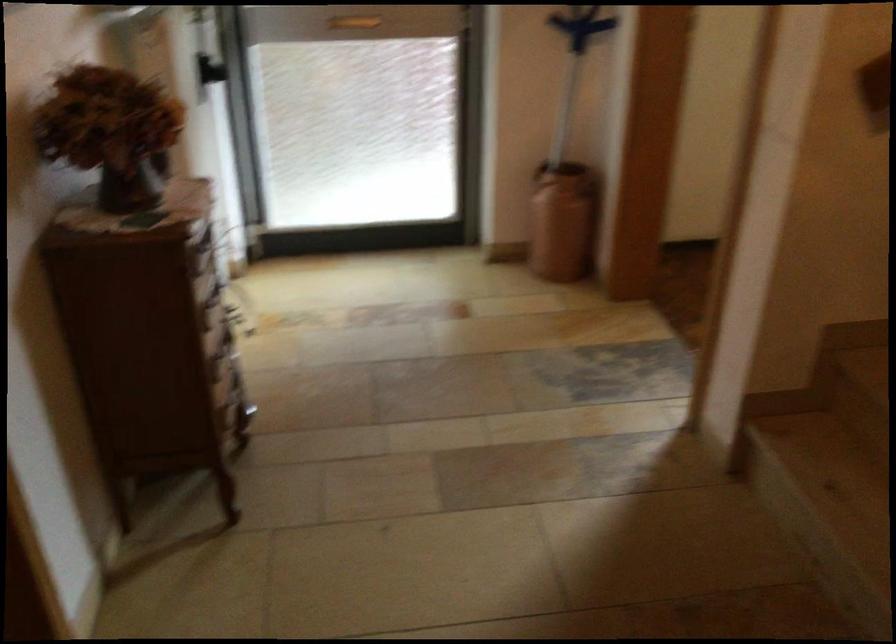
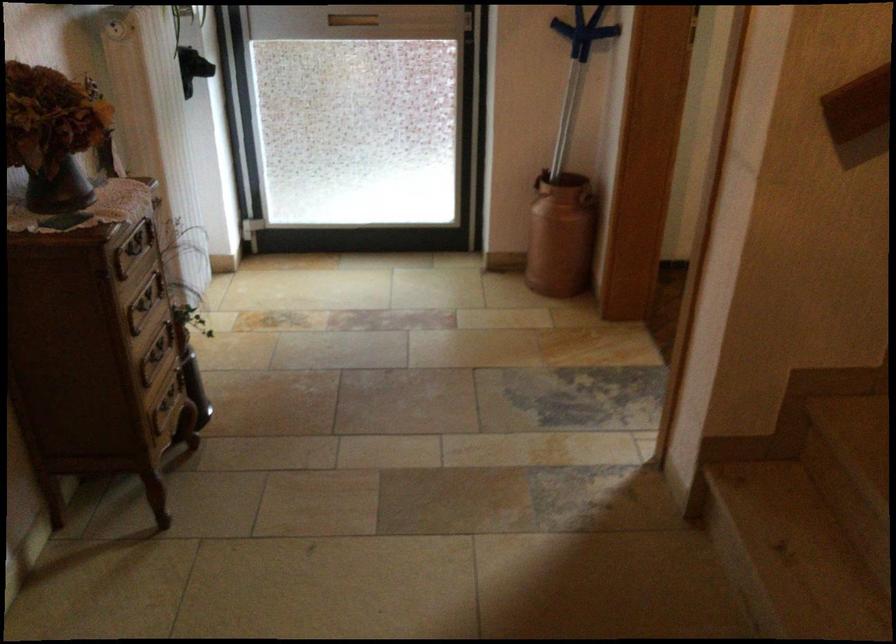
The point at (135, 134) is marked in the first image. Where is the corresponding point in the second image?

(53, 134)